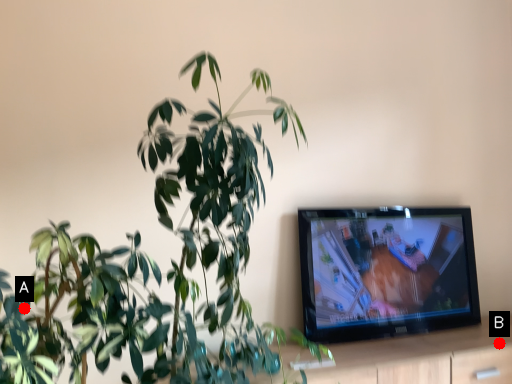
Question: Two points are circled on the image, labeled by A and B beside each circle. Which point is closer to the camera?

Choices:
 (A) A is closer
 (B) B is closer

Answer: (A)